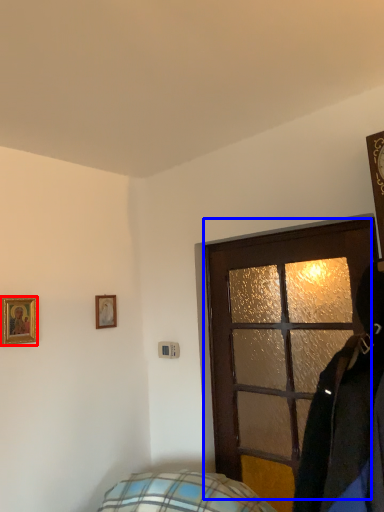
Question: Which of the following is the closest to the observer, picture frame (highlighted by a red box) or door (highlighted by a blue box)?

Choices:
 (A) picture frame
 (B) door

Answer: (B)